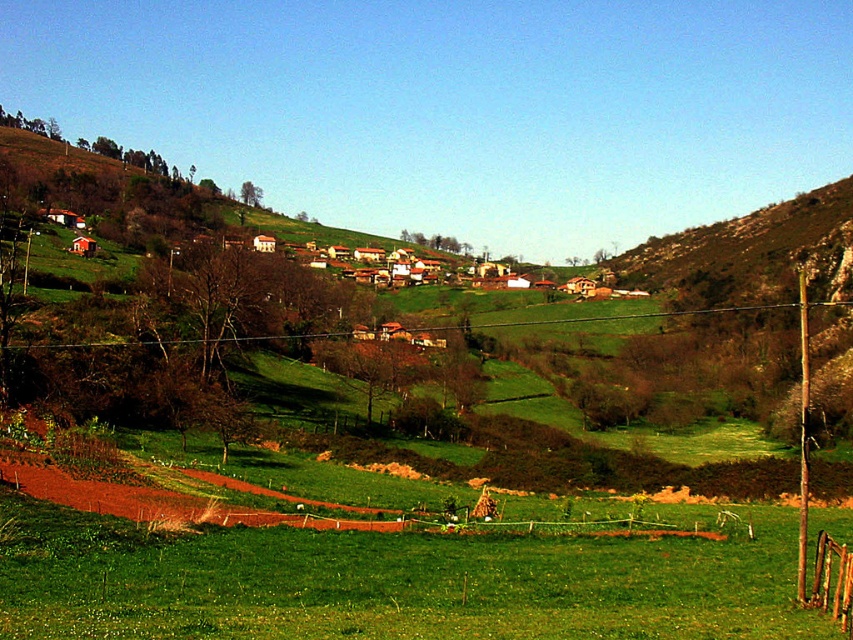
Is brown wooden fence at lower right above brown furry dog at center?

Yes, brown wooden fence at lower right is above brown furry dog at center.

Is brown wooden fence at lower right smaller than brown furry dog at center?

Yes, brown wooden fence at lower right is smaller than brown furry dog at center.

I want to click on brown wooden fence at lower right, so click(x=830, y=579).